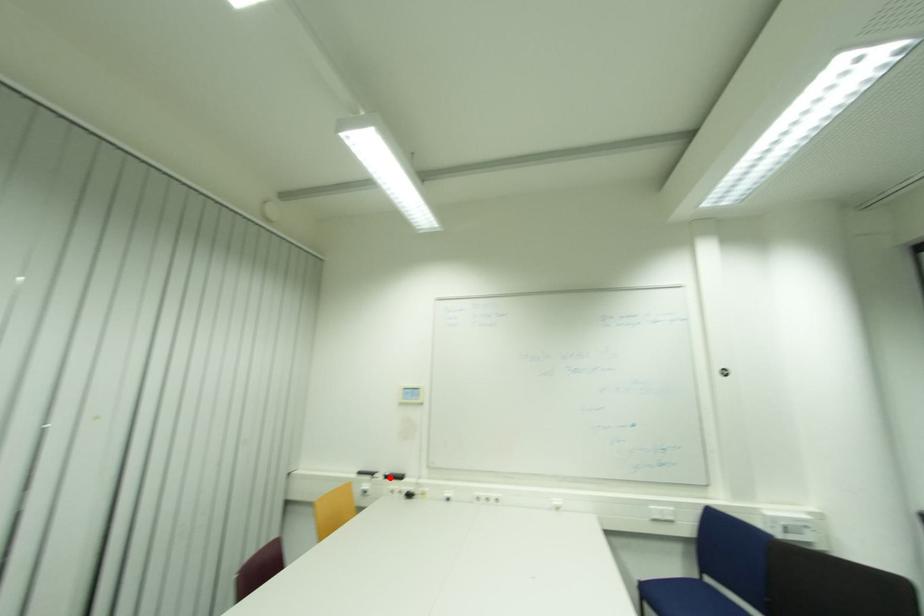
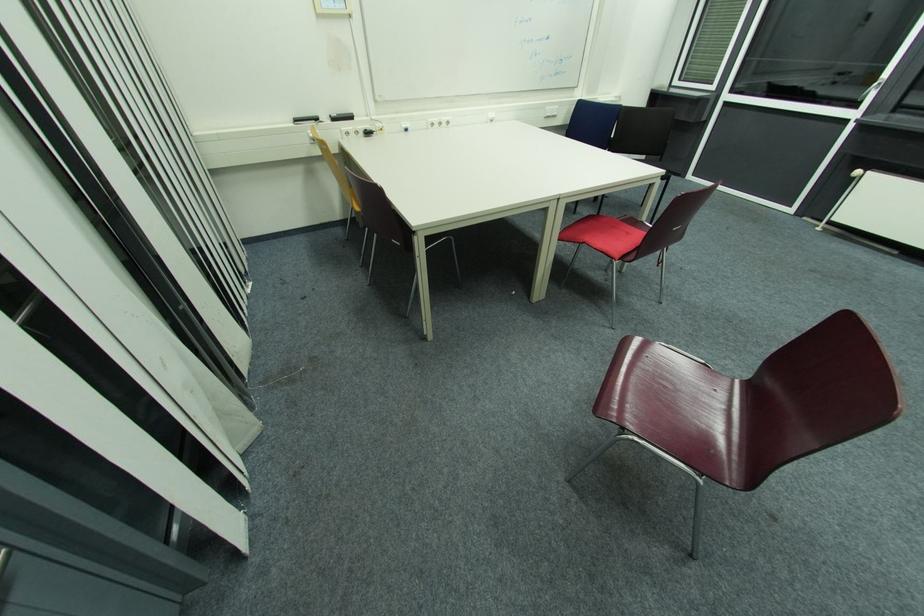
Locate, in the second image, the point that corresponds to the highlighted location in the first image.

(337, 121)